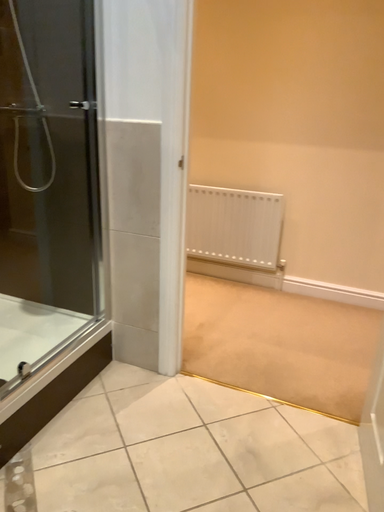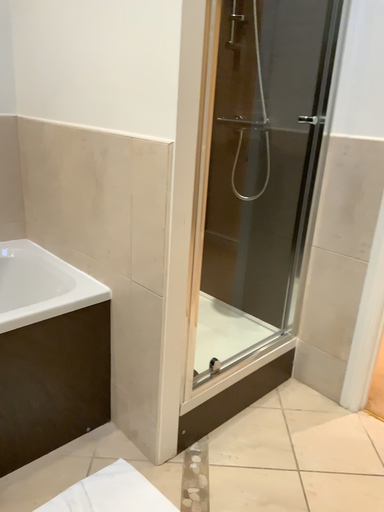
Question: Which way did the camera rotate in the video?

Choices:
 (A) rotated left
 (B) rotated right

Answer: (A)